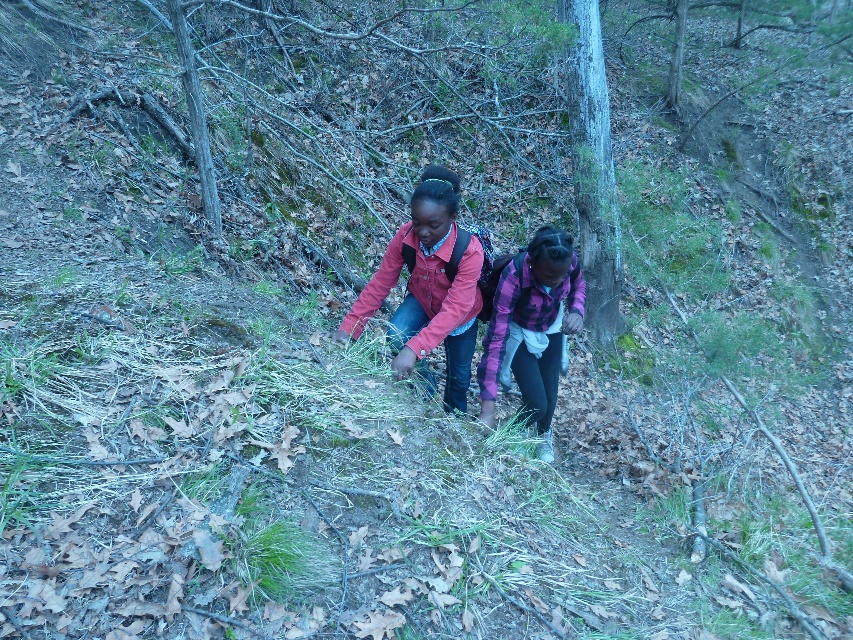
Question: Which point appears closest to the camera in this image?

Choices:
 (A) (590, 0)
 (B) (448, 401)

Answer: (B)

Question: Does matte pink jacket at center appear on the left side of purple fleece jacket at center?

Choices:
 (A) no
 (B) yes

Answer: (B)

Question: Which of the following is the farthest from the observer?

Choices:
 (A) purple fleece jacket at center
 (B) smooth gray bark at center
 (C) matte pink jacket at center

Answer: (B)

Question: Is matte pink jacket at center thinner than smooth gray bark at center?

Choices:
 (A) no
 (B) yes

Answer: (A)

Question: Which point appears farthest from the camera in this image?

Choices:
 (A) (576, 324)
 (B) (436, 300)
 (C) (608, 272)

Answer: (C)

Question: Can you confirm if purple fleece jacket at center is positioned above smooth gray bark at center?

Choices:
 (A) yes
 (B) no

Answer: (B)